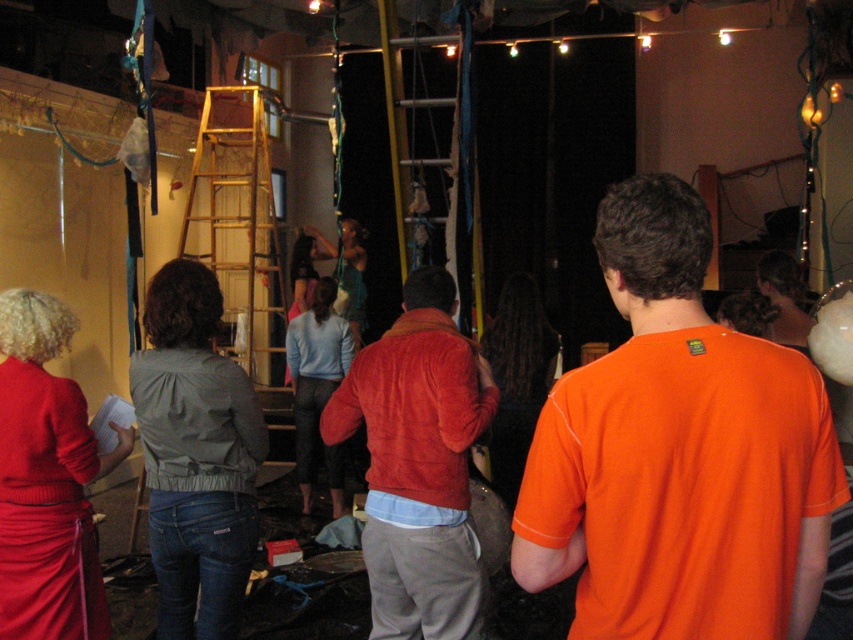
You are standing in the room and want to move from the wooden at left to the light blue sweater at center. Which direction should you move?

You should move to the right because the wooden at left is to the left of the light blue sweater at center.